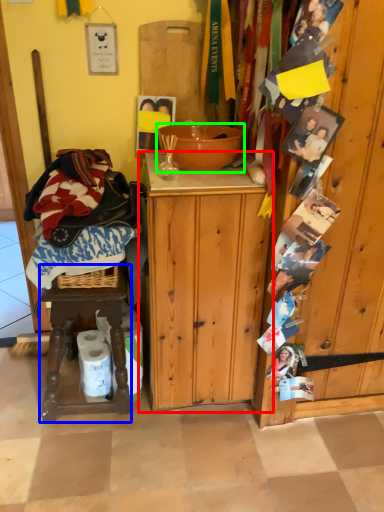
Question: Which is nearer to the cabinetry (highlighted by a red box)? stool (highlighted by a blue box) or bowl (highlighted by a green box).

Choices:
 (A) stool
 (B) bowl

Answer: (A)